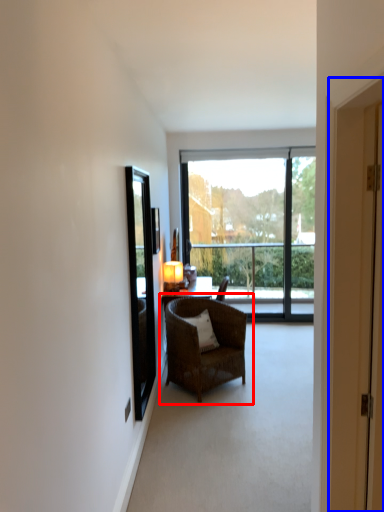
Question: Which point is closer to the camera, chair (highlighted by a red box) or door (highlighted by a blue box)?

Choices:
 (A) chair
 (B) door

Answer: (B)